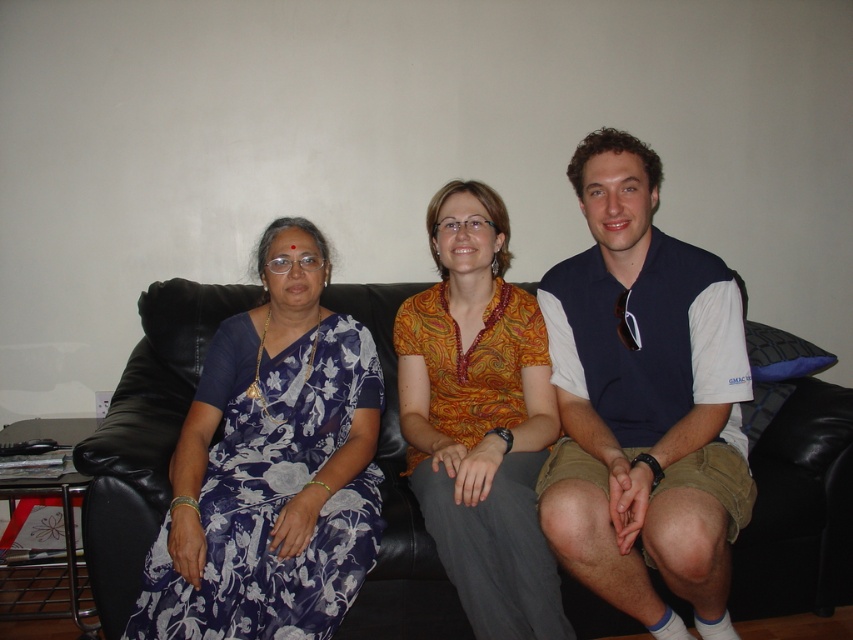
You are a photographer setting up for a group photo. You need to ensure that the blue cotton polo shirt at center and the orange paisley shirt at center are at least 25 centimeters apart for proper framing. Based on the image, will their current distance meet this requirement?

The blue cotton polo shirt at center is 21.76 centimeters away from the orange paisley shirt at center, which is less than the required 25 centimeters. Therefore, their current distance does not meet the requirement.

From the picture: You are a photographer standing 1.5 meters away from the camera. You want to take a photo of the blue cotton polo shirt at center. Can you reach the shirt to adjust it without moving the camera?

The blue cotton polo shirt at center and camera are 1.42 meters apart. Since you are 1.5 meters away from the camera, you are just slightly farther than the distance between the shirt and the camera. You might need to step closer to reach the shirt without moving the camera.

You are standing in front of the couch where three people are sitting. You notice two points marked on the couch. One is at coordinate point (x=828, y=448) and the other is at point (x=616, y=316). Which of these two points is closer to you?

Point (x=828, y=448) is closer to you because it is further to the viewer than point (x=616, y=316).